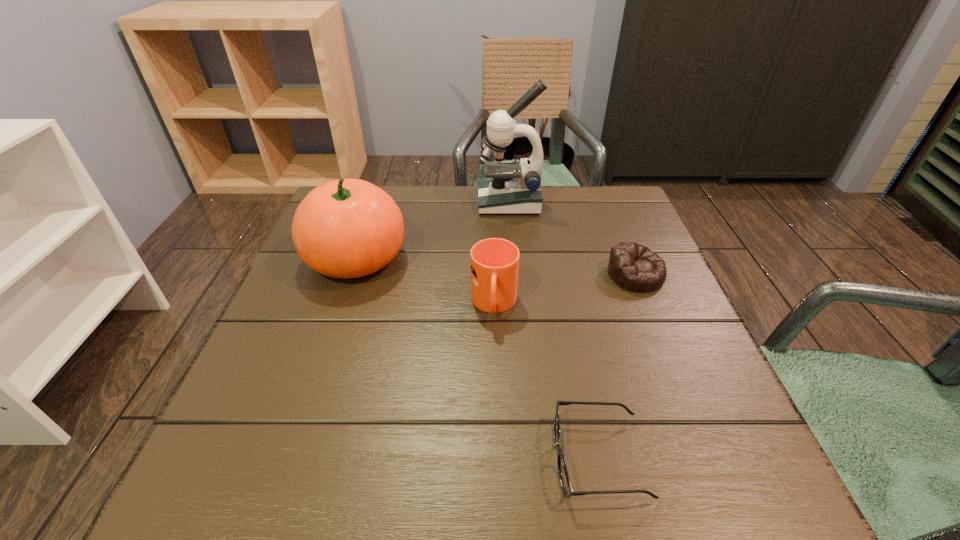
Where is `free space between the mug and the rightmost object`? free space between the mug and the rightmost object is located at coordinates (564, 289).

Locate an element on the screen. This screenshot has height=540, width=960. vacant space that is in between the rightmost object and the nearest object is located at coordinates (617, 366).

You are a GUI agent. You are given a task and a screenshot of the screen. Output one action in this format:
    pyautogui.click(x=<x>, y=<y>)
    Task: Click on the free space between the mug and the pumpkin
    
    Given the screenshot: What is the action you would take?
    pyautogui.click(x=425, y=281)

Where is `empty space between the nearest object and the second shortest object`? empty space between the nearest object and the second shortest object is located at coordinates [x=617, y=366].

Where is `free space between the second shortest object and the third shortest object`? Image resolution: width=960 pixels, height=540 pixels. free space between the second shortest object and the third shortest object is located at coordinates (564, 289).

Locate an element on the screen. free point between the nearest object and the third tallest object is located at coordinates (546, 381).

Identify the location of object that stands as the third closest to the beanbag. Image resolution: width=960 pixels, height=540 pixels. (564, 479).

You are a GUI agent. You are given a task and a screenshot of the screen. Output one action in this format:
    pyautogui.click(x=<x>, y=<y>)
    Task: Click on the third closest object to the tallest object
    The image size is (960, 540).
    Given the screenshot: What is the action you would take?
    pyautogui.click(x=494, y=262)